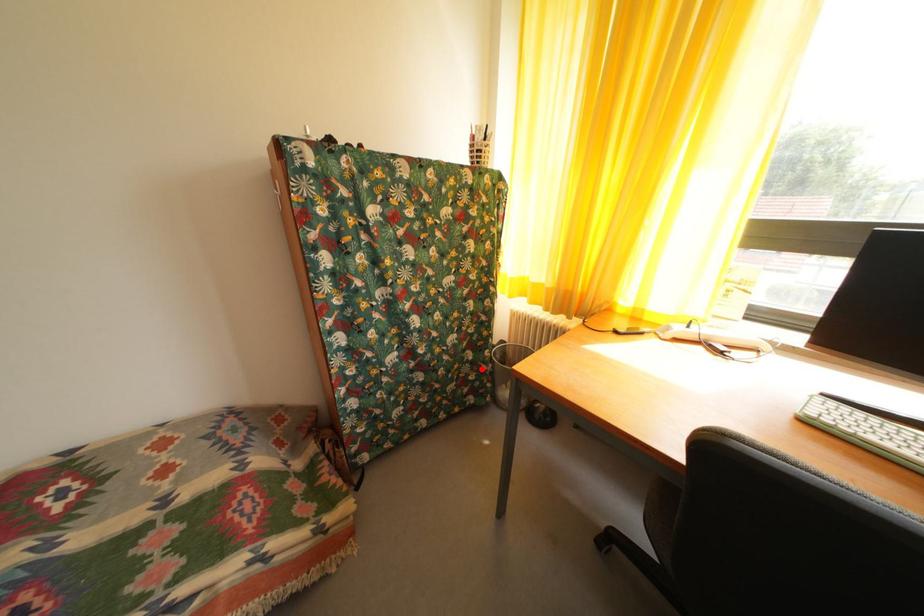
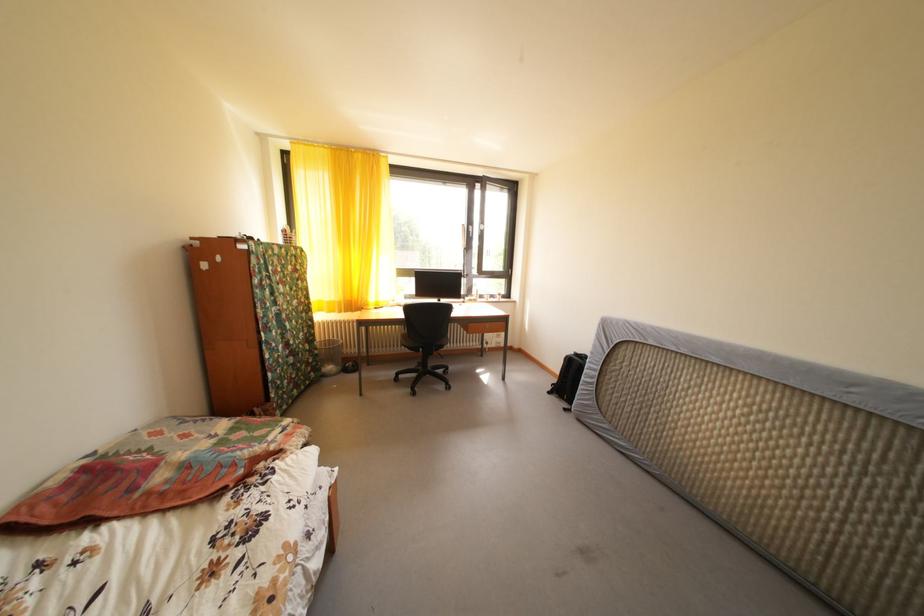
Question: I am providing you with two images of the same scene from different viewpoints. Image1 has a red point marked. In image2, the corresponding 3D location appears at what relative position? Reply with the corresponding letter.

Choices:
 (A) Closer
 (B) Farther

Answer: (A)